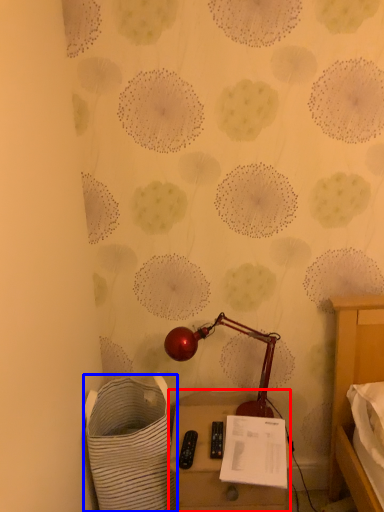
Question: Among these objects, which one is farthest to the camera, furniture (highlighted by a red box) or laundry basket (highlighted by a blue box)?

Choices:
 (A) furniture
 (B) laundry basket

Answer: (A)